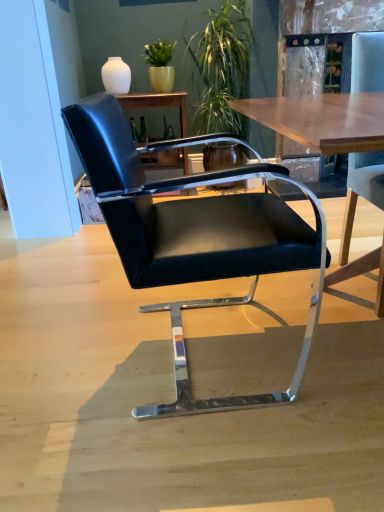
Image resolution: width=384 pixels, height=512 pixels. I want to click on free space in front of black leather chair at center, the 1th chair in the left-to-right sequence, so click(x=223, y=455).